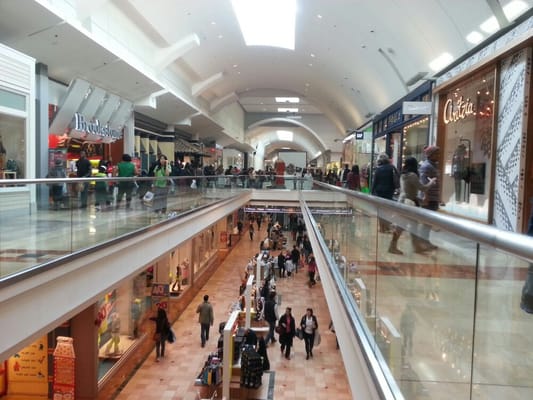
The image size is (533, 400). Find the location of `first floor`. first floor is located at coordinates (160, 377).